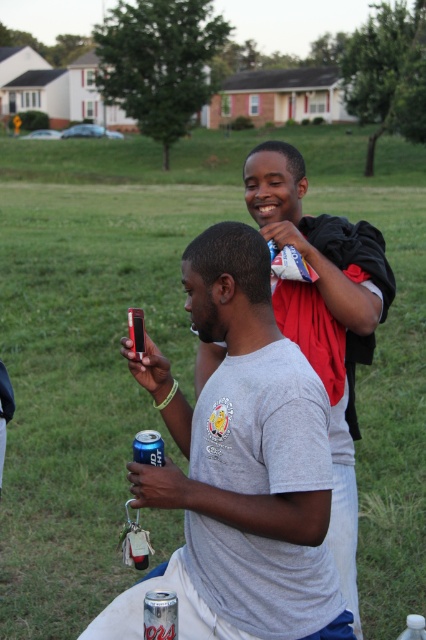
You are at a picnic and want to take a photo of the matte black phone at center and the clear plastic bottle at center. Which object should you focus on first to ensure both are in focus?

You should focus on the matte black phone at center first since it is closer to the viewer than the clear plastic bottle at center, ensuring both will be in focus when using a camera with a fixed focal plane.

Consider the image. What object is located at the coordinates point [244,470] in the image?

The matte black phone at center is located at point [244,470].